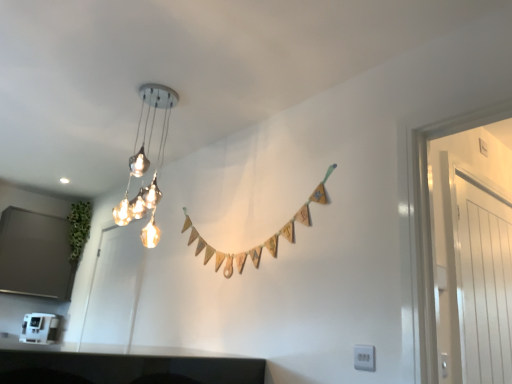
Describe the element at coordinates (483, 281) in the screenshot. This screenshot has width=512, height=384. I see `white glossy door at right, marked as the 2th glass door in a left-to-right arrangement` at that location.

Where is `white plastic coffee machine at lower left`? This screenshot has height=384, width=512. white plastic coffee machine at lower left is located at coordinates (39, 328).

The width and height of the screenshot is (512, 384). What are the coordinates of `white plastic electric outlet at lower right` in the screenshot? It's located at (364, 357).

This screenshot has width=512, height=384. Describe the element at coordinates (115, 287) in the screenshot. I see `matte white door at left, which is the 1th glass door in back-to-front order` at that location.

Locate an element on the screen. white glossy door at right, the second glass door from the back is located at coordinates (483, 281).

Considering the sizes of objects metallic glass chandelier at upper center and matte white door at left, which is the 1th glass door in back-to-front order, in the image provided, who is shorter, metallic glass chandelier at upper center or matte white door at left, which is the 1th glass door in back-to-front order,?

metallic glass chandelier at upper center is shorter.

Considering the sizes of metallic glass chandelier at upper center and matte white door at left, positioned as the second glass door in front-to-back order, in the image, is metallic glass chandelier at upper center bigger or smaller than matte white door at left, positioned as the second glass door in front-to-back order,?

Clearly, metallic glass chandelier at upper center is smaller in size than matte white door at left, positioned as the second glass door in front-to-back order.

Which point is more distant from viewer, (x=134, y=168) or (x=114, y=289)?

Point (x=114, y=289)

Is matte white door at left, which is the 1th glass door in back-to-front order, a part of metallic glass chandelier at upper center?

No, matte white door at left, which is the 1th glass door in back-to-front order, is not inside metallic glass chandelier at upper center.

Considering the sizes of metallic glass chandelier at upper center and white glossy door at right, which ranks as the 1th glass door in front-to-back order, in the image, is metallic glass chandelier at upper center taller or shorter than white glossy door at right, which ranks as the 1th glass door in front-to-back order,?

In the image, metallic glass chandelier at upper center appears to be shorter than white glossy door at right, which ranks as the 1th glass door in front-to-back order.

Considering the positions of points (130, 162) and (466, 212), is point (130, 162) closer to camera compared to point (466, 212)?

No, (130, 162) is behind (466, 212).

Is metallic glass chandelier at upper center surrounding white glossy door at right, which is counted as the first glass door, starting from the right?

Actually, white glossy door at right, which is counted as the first glass door, starting from the right, is outside metallic glass chandelier at upper center.

Between metallic glass chandelier at upper center and white glossy door at right, which ranks as the 1th glass door in front-to-back order, which one has smaller size?

With smaller size is white glossy door at right, which ranks as the 1th glass door in front-to-back order.

From the image's perspective, is matte white door at left, which is the 1th glass door in back-to-front order, above white plastic electric outlet at lower right?

Incorrect, from the image's perspective, matte white door at left, which is the 1th glass door in back-to-front order, is lower than white plastic electric outlet at lower right.

Image resolution: width=512 pixels, height=384 pixels. In order to click on electric outlet that is above the matte white door at left, which is the 1th glass door in back-to-front order (from the image's perspective) in this screenshot , I will do `click(364, 357)`.

From a real-world perspective, is matte white door at left, which ranks as the first glass door in left-to-right order, above or below white plastic electric outlet at lower right?

From a real-world perspective, matte white door at left, which ranks as the first glass door in left-to-right order, is physically above white plastic electric outlet at lower right.

Does point (371, 358) come farther from viewer compared to point (44, 327)?

No, (371, 358) is in front of (44, 327).

Does white plastic electric outlet at lower right lie in front of white plastic coffee machine at lower left?

Yes, white plastic electric outlet at lower right is closer to the viewer.

Would you say white plastic electric outlet at lower right is outside white plastic coffee machine at lower left?

Absolutely, white plastic electric outlet at lower right is external to white plastic coffee machine at lower left.

Is white glossy door at right, which is counted as the first glass door, starting from the right, inside the boundaries of metallic glass chandelier at upper center, or outside?

white glossy door at right, which is counted as the first glass door, starting from the right, is located beyond the bounds of metallic glass chandelier at upper center.

From the image's perspective, is white glossy door at right, marked as the 2th glass door in a left-to-right arrangement, positioned above or below metallic glass chandelier at upper center?

Based on their image positions, white glossy door at right, marked as the 2th glass door in a left-to-right arrangement, is located beneath metallic glass chandelier at upper center.

Looking at this image, which object is thinner, white glossy door at right, marked as the 2th glass door in a left-to-right arrangement, or metallic glass chandelier at upper center?

white glossy door at right, marked as the 2th glass door in a left-to-right arrangement, is thinner.

Is point (506, 359) closer to viewer compared to point (170, 103)?

Yes, it is in front of point (170, 103).

Is white plastic electric outlet at lower right positioned with its back to matte white door at left, which is the 1th glass door in back-to-front order?

No, white plastic electric outlet at lower right's orientation is not away from matte white door at left, which is the 1th glass door in back-to-front order.

From the image's perspective, which one is positioned higher, white plastic electric outlet at lower right or matte white door at left, which ranks as the first glass door in left-to-right order?

From the image's view, white plastic electric outlet at lower right is above.

Can you confirm if white plastic electric outlet at lower right is smaller than matte white door at left, which ranks as the first glass door in left-to-right order?

Indeed, white plastic electric outlet at lower right has a smaller size compared to matte white door at left, which ranks as the first glass door in left-to-right order.

Locate an element on the screen. Image resolution: width=512 pixels, height=384 pixels. appliance that is on the left side of white glossy door at right, which ranks as the 1th glass door in front-to-back order is located at coordinates (39, 328).

Is white plastic coffee machine at lower left at the left side of white glossy door at right, which is counted as the first glass door, starting from the right?

Yes, white plastic coffee machine at lower left is to the left of white glossy door at right, which is counted as the first glass door, starting from the right.

From a real-world perspective, which object stands above the other?

From a 3D spatial view, white glossy door at right, the second glass door from the back, is above.

Which point is more forward, (44, 325) or (506, 245)?

Positioned in front is point (506, 245).

Locate an element on the screen. The width and height of the screenshot is (512, 384). lamp lying above the matte white door at left, which appears as the 2th glass door when viewed from the right (from the image's perspective) is located at coordinates (147, 165).

From the image's perspective, starting from the metallic glass chandelier at upper center, which glass door is the 1st one below? Please provide its 2D coordinates.

[(483, 281)]

Looking at this image, based on their spatial positions, is metallic glass chandelier at upper center or white glossy door at right, which is counted as the first glass door, starting from the right, closer to white plastic coffee machine at lower left?

metallic glass chandelier at upper center lies closer to white plastic coffee machine at lower left than the other object.

Based on their spatial positions, is metallic glass chandelier at upper center or matte white door at left, which ranks as the first glass door in left-to-right order, further from white glossy door at right, marked as the 2th glass door in a left-to-right arrangement?

matte white door at left, which ranks as the first glass door in left-to-right order, is further to white glossy door at right, marked as the 2th glass door in a left-to-right arrangement.

Based on their spatial positions, is metallic glass chandelier at upper center or white glossy door at right, the second glass door from the back, further from white plastic electric outlet at lower right?

metallic glass chandelier at upper center is further to white plastic electric outlet at lower right.

Considering their positions, is metallic glass chandelier at upper center positioned closer to white plastic coffee machine at lower left than matte white door at left, which is the 1th glass door in back-to-front order?

matte white door at left, which is the 1th glass door in back-to-front order.

Considering their positions, is white plastic coffee machine at lower left positioned further to white glossy door at right, which is counted as the first glass door, starting from the right, than matte white door at left, positioned as the second glass door in front-to-back order?

The object further to white glossy door at right, which is counted as the first glass door, starting from the right, is white plastic coffee machine at lower left.

Considering their positions, is white glossy door at right, which ranks as the 1th glass door in front-to-back order, positioned closer to metallic glass chandelier at upper center than white plastic electric outlet at lower right?

white glossy door at right, which ranks as the 1th glass door in front-to-back order, is closer to metallic glass chandelier at upper center.

When comparing their distances from metallic glass chandelier at upper center, does white plastic electric outlet at lower right or matte white door at left, positioned as the second glass door in front-to-back order, seem closer?

matte white door at left, positioned as the second glass door in front-to-back order, lies closer to metallic glass chandelier at upper center than the other object.

Looking at the image, which one is located closer to white glossy door at right, marked as the 2th glass door in a left-to-right arrangement, metallic glass chandelier at upper center or white plastic coffee machine at lower left?

metallic glass chandelier at upper center is positioned closer to the anchor white glossy door at right, marked as the 2th glass door in a left-to-right arrangement.

You are a GUI agent. You are given a task and a screenshot of the screen. Output one action in this format:
    pyautogui.click(x=<x>, y=<y>)
    Task: Click on the lamp between matte white door at left, which appears as the 2th glass door when viewed from the right, and white glossy door at right, which is counted as the first glass door, starting from the right
    This screenshot has height=384, width=512.
    Given the screenshot: What is the action you would take?
    pyautogui.click(x=147, y=165)

At what (x,y) coordinates should I click in order to perform the action: click on electric outlet between metallic glass chandelier at upper center and white glossy door at right, which ranks as the 1th glass door in front-to-back order, from left to right. Please return your answer as a coordinate pair (x, y). This screenshot has width=512, height=384. Looking at the image, I should click on (364, 357).

Image resolution: width=512 pixels, height=384 pixels. What are the coordinates of `lamp between white plastic coffee machine at lower left and white glossy door at right, the second glass door from the back, in the horizontal direction` in the screenshot? It's located at (147, 165).

Find the location of `electric outlet between white plastic coffee machine at lower left and white glossy door at right, the second glass door from the back, in the horizontal direction`. electric outlet between white plastic coffee machine at lower left and white glossy door at right, the second glass door from the back, in the horizontal direction is located at coordinates (364, 357).